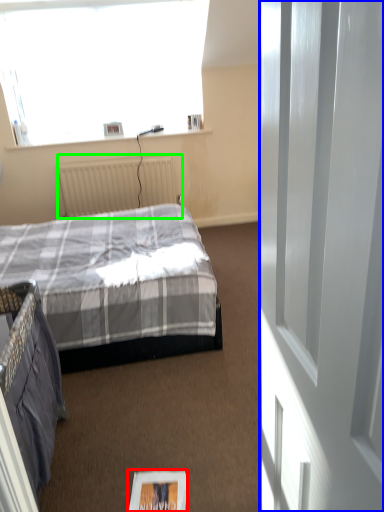
Question: Which object is positioned farthest from magazine (highlighted by a red box)? Select from screen door (highlighted by a blue box) and radiator (highlighted by a green box).

Choices:
 (A) screen door
 (B) radiator

Answer: (B)